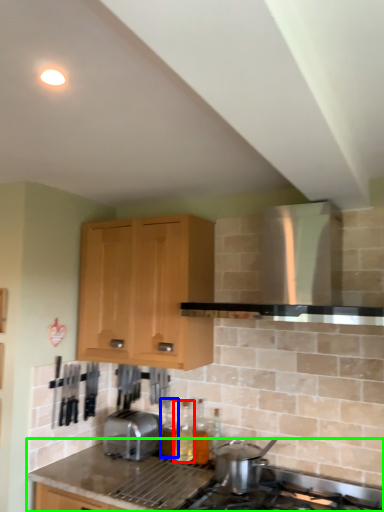
Question: Which object is positioned closest to bottle (highlighted by a red box)? Select from bottle (highlighted by a blue box) and countertop (highlighted by a green box).

Choices:
 (A) bottle
 (B) countertop

Answer: (A)